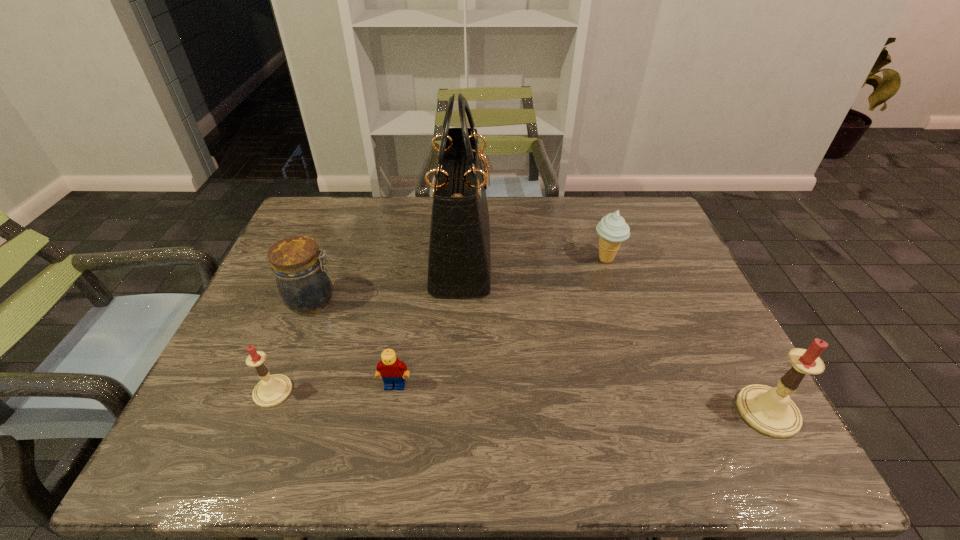
The width and height of the screenshot is (960, 540). Identify the location of object at the near right corner. (769, 410).

Where is `vacant area at the far edge`? This screenshot has height=540, width=960. vacant area at the far edge is located at coordinates (502, 233).

This screenshot has width=960, height=540. Identify the location of free space at the near edge. (408, 403).

You are a GUI agent. You are given a task and a screenshot of the screen. Output one action in this format:
    pyautogui.click(x=<x>, y=<y>)
    Task: Click on the vacant space at the left edge
    This screenshot has height=540, width=960.
    Given the screenshot: What is the action you would take?
    pyautogui.click(x=254, y=326)

In the image, there is a desktop. Identify the location of free region at the right edge. (721, 361).

This screenshot has width=960, height=540. I want to click on free point at the far left corner, so click(339, 216).

Locate an element on the screen. This screenshot has width=960, height=540. vacant space at the near right corner of the desktop is located at coordinates (705, 388).

Where is `empty space that is in between the Lego and the second object from right to left`? The width and height of the screenshot is (960, 540). empty space that is in between the Lego and the second object from right to left is located at coordinates (500, 322).

Locate an element on the screen. Image resolution: width=960 pixels, height=540 pixels. vacant area between the shorter candle and the jar is located at coordinates (293, 346).

Locate an element on the screen. free point between the jar and the second tallest object is located at coordinates (540, 355).